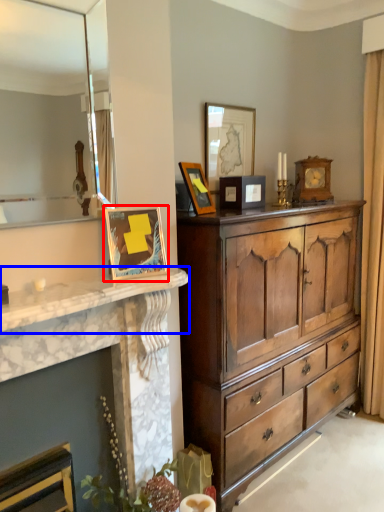
Question: Which of the following is the closest to the observer, picture frame (highlighted by a red box) or countertop (highlighted by a blue box)?

Choices:
 (A) picture frame
 (B) countertop

Answer: (B)